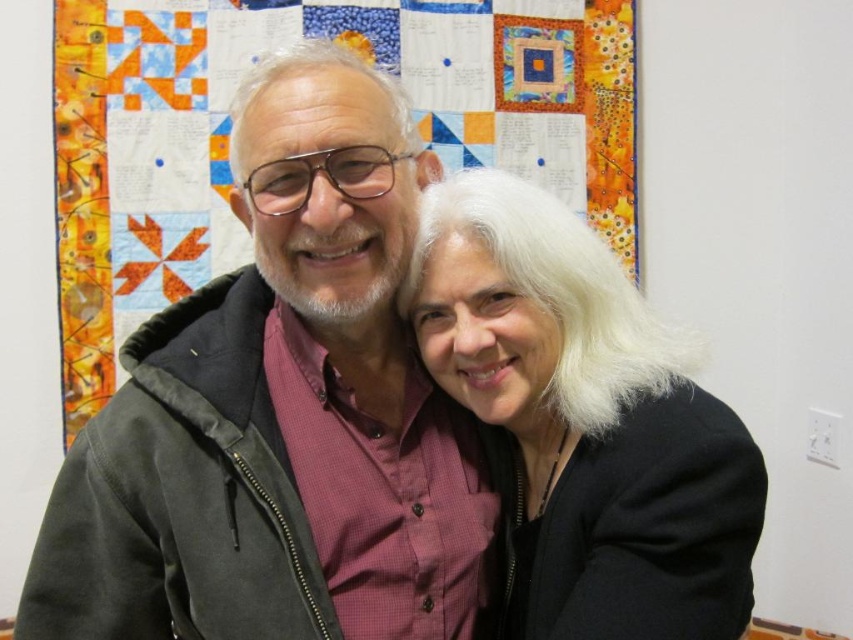
Question: Among these points, which one is nearest to the camera?

Choices:
 (A) (271, 104)
 (B) (401, 310)

Answer: (A)

Question: Observing the image, what is the correct spatial positioning of matte black jacket at center in reference to white matte hair at center?

Choices:
 (A) below
 (B) above

Answer: (B)

Question: Which point appears farthest from the camera in this image?

Choices:
 (A) (543, 552)
 (B) (78, 557)

Answer: (A)

Question: Can you confirm if matte black jacket at center is smaller than white matte hair at center?

Choices:
 (A) yes
 (B) no

Answer: (B)

Question: Is matte black jacket at center positioned before white matte hair at center?

Choices:
 (A) yes
 (B) no

Answer: (B)